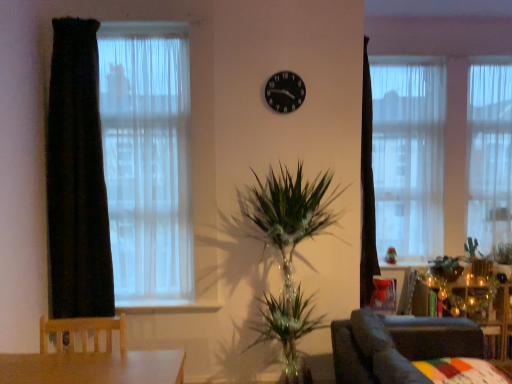
Where is `wooden side table at lower right`? The width and height of the screenshot is (512, 384). wooden side table at lower right is located at coordinates (477, 303).

The height and width of the screenshot is (384, 512). What do you see at coordinates (285, 91) in the screenshot?
I see `black plastic clock at upper center` at bounding box center [285, 91].

You are a GUI agent. You are given a task and a screenshot of the screen. Output one action in this format:
    pyautogui.click(x=<x>, y=<y>)
    Task: Click on the black plastic clock at upper center
    The height and width of the screenshot is (384, 512).
    Given the screenshot: What is the action you would take?
    pyautogui.click(x=285, y=91)

Image resolution: width=512 pixels, height=384 pixels. In order to click on white sheer curtain at right, acting as the 3th curtain starting from the front in this screenshot , I will do `click(489, 151)`.

This screenshot has width=512, height=384. What do you see at coordinates (398, 346) in the screenshot? I see `velvet dark gray sofa at lower right` at bounding box center [398, 346].

Measure the distance between point (416, 376) and camera.

The depth of point (416, 376) is 4.96 feet.

Where is `wooden side table at lower right`? wooden side table at lower right is located at coordinates (477, 303).

Can you confirm if white sheer curtain at upper right, the second curtain in the back-to-front sequence, is wider than white sheer curtain at right, which appears as the third curtain when viewed from the left?

In fact, white sheer curtain at upper right, the second curtain in the back-to-front sequence, might be narrower than white sheer curtain at right, which appears as the third curtain when viewed from the left.

Is white sheer curtain at upper right, the second curtain in the back-to-front sequence, in front of or behind white sheer curtain at right, acting as the 3th curtain starting from the front, in the image?

In the image, white sheer curtain at upper right, the second curtain in the back-to-front sequence, appears in front of white sheer curtain at right, acting as the 3th curtain starting from the front.

Between white sheer curtain at upper right, the second curtain in the back-to-front sequence, and white sheer curtain at right, which appears as the third curtain when viewed from the left, which one has smaller size?

Smaller between the two is white sheer curtain at right, which appears as the third curtain when viewed from the left.

Who is taller, white sheer curtain at upper right, which is the second curtain from left to right, or white sheer curtain at right, which appears as the third curtain when viewed from the left?

Standing taller between the two is white sheer curtain at upper right, which is the second curtain from left to right.

I want to click on the 1st curtain above the green leafy plant at right (from the image's perspective), so click(77, 178).

Between green leafy plant at right and dark velvet curtain at left, positioned as the 1th curtain in front-to-back order, which one has more height?

With more height is dark velvet curtain at left, positioned as the 1th curtain in front-to-back order.

Can you tell me how much green leafy plant at right and dark velvet curtain at left, the 1th curtain when ordered from left to right, differ in facing direction?

89.1 degrees.

Does green leafy plant at right lie in front of dark velvet curtain at left, the 1th curtain when ordered from left to right?

No, green leafy plant at right is behind dark velvet curtain at left, the 1th curtain when ordered from left to right.

From a real-world perspective, which object rests below the other?

green glossy plant at right, from a real-world perspective.

In the scene shown: Which object is thinner, white sheer curtain at left or green glossy plant at right?

Thinner between the two is white sheer curtain at left.

Which point is more forward, (x=160, y=281) or (x=451, y=261)?

Point (x=160, y=281)

Who is taller, white sheer curtain at left or green glossy plant at right?

With more height is white sheer curtain at left.

From a real-world perspective, is black plastic clock at upper center beneath white sheer curtain at upper right, which is the second curtain from left to right?

Incorrect, from a real-world perspective, black plastic clock at upper center is higher than white sheer curtain at upper right, which is the second curtain from left to right.

Is point (304, 98) closer to camera compared to point (421, 233)?

Yes, point (304, 98) is closer to viewer.

Does black plastic clock at upper center contain white sheer curtain at upper right, the second curtain from the right?

No, black plastic clock at upper center does not contain white sheer curtain at upper right, the second curtain from the right.

Looking at this image, how many degrees apart are the facing directions of velvet dark gray sofa at lower right and dark velvet curtain at left, which ranks as the 3th curtain in back-to-front order?

1.34 degrees separate the facing orientations of velvet dark gray sofa at lower right and dark velvet curtain at left, which ranks as the 3th curtain in back-to-front order.

Between velvet dark gray sofa at lower right and dark velvet curtain at left, the 3th curtain when ordered from right to left, which one has larger width?

With larger width is velvet dark gray sofa at lower right.

From a real-world perspective, which is physically below, velvet dark gray sofa at lower right or dark velvet curtain at left, the 3th curtain when ordered from right to left?

From a 3D spatial view, velvet dark gray sofa at lower right is below.

Identify the location of window behind the velvet dark gray sofa at lower right. (146, 160).

Is velvet dark gray sofa at lower right wider than white sheer curtain at left?

Yes.

Which object is positioned more to the right, velvet dark gray sofa at lower right or white sheer curtain at left?

Positioned to the right is velvet dark gray sofa at lower right.

Is point (398, 383) closer or farther from the camera than point (125, 249)?

Point (398, 383) is positioned closer to the camera compared to point (125, 249).

From the image's perspective, is white sheer curtain at upper right, which is the second curtain from left to right, above green leafy plant at right?

Yes, from the image's perspective, white sheer curtain at upper right, which is the second curtain from left to right, is on top of green leafy plant at right.

Based on their positions, is white sheer curtain at upper right, the second curtain when ordered from front to back, located to the left or right of green leafy plant at right?

In the image, white sheer curtain at upper right, the second curtain when ordered from front to back, appears on the left side of green leafy plant at right.

Is white sheer curtain at upper right, the second curtain from the right, not near green leafy plant at right?

white sheer curtain at upper right, the second curtain from the right, is positioned a significant distance from green leafy plant at right.

Identify the location of curtain that is the 1st object located below the white sheer curtain at right, acting as the 3th curtain starting from the front (from the image's perspective). The height and width of the screenshot is (384, 512). (408, 154).

What are the coordinates of `plant below the dark velvet curtain at left, the 1th curtain when ordered from left to right (from a real-world perspective)` in the screenshot? It's located at (502, 253).

From the image, which object appears to be nearer to velvet dark gray sofa at lower right, white sheer curtain at upper right, the second curtain from the right, or white sheer curtain at right, which appears as the third curtain when viewed from the left?

The object closer to velvet dark gray sofa at lower right is white sheer curtain at upper right, the second curtain from the right.

From the image, which object appears to be farther from dark velvet curtain at left, the 1th curtain when ordered from left to right, black plastic clock at upper center or wooden side table at lower right?

wooden side table at lower right is positioned further to the anchor dark velvet curtain at left, the 1th curtain when ordered from left to right.

Considering their positions, is velvet dark gray sofa at lower right positioned closer to wooden side table at lower right than white sheer curtain at left?

velvet dark gray sofa at lower right.

Based on their spatial positions, is green glossy plant at right or green leafy plant at right further from white sheer curtain at left?

green leafy plant at right lies further to white sheer curtain at left than the other object.

Which object lies nearer to the anchor point wooden side table at lower right, green glossy plant at right or white sheer curtain at upper right, the second curtain from the right?

green glossy plant at right is closer to wooden side table at lower right.

From the picture: Which object lies nearer to the anchor point black plastic clock at upper center, wooden side table at lower right or velvet dark gray sofa at lower right?

velvet dark gray sofa at lower right lies closer to black plastic clock at upper center than the other object.

Considering their positions, is green leafy plant at right positioned further to black plastic clock at upper center than dark velvet curtain at left, the 3th curtain when ordered from right to left?

green leafy plant at right.

Estimate the real-world distances between objects in this image. Which object is closer to wooden side table at lower right, green leafy plant at right or velvet dark gray sofa at lower right?

Based on the image, green leafy plant at right appears to be nearer to wooden side table at lower right.

You are a GUI agent. You are given a task and a screenshot of the screen. Output one action in this format:
    pyautogui.click(x=<x>, y=<y>)
    Task: Click on the window located between dark velvet curtain at left, the 1th curtain when ordered from left to right, and wooden side table at lower right in the left-right direction
    This screenshot has width=512, height=384.
    Given the screenshot: What is the action you would take?
    pyautogui.click(x=146, y=160)

Identify the location of side table between black plastic clock at upper center and white sheer curtain at right, acting as the 3th curtain starting from the front. (477, 303).

Locate an element on the screen. curtain between dark velvet curtain at left, which ranks as the 3th curtain in back-to-front order, and green leafy plant at right, in the horizontal direction is located at coordinates (408, 154).

Find the location of `window between dark velvet curtain at left, which ranks as the 3th curtain in back-to-front order, and green leafy plant at right from left to right`. window between dark velvet curtain at left, which ranks as the 3th curtain in back-to-front order, and green leafy plant at right from left to right is located at coordinates (146, 160).